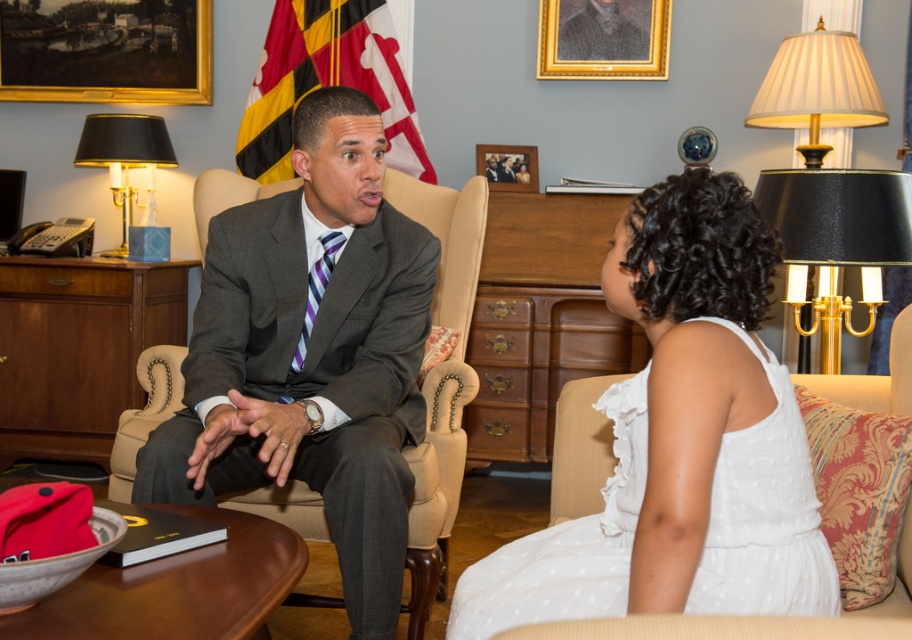
Between black fabric lampshade at left and wooden picture frame at upper center, which one appears on the left side from the viewer's perspective?

black fabric lampshade at left is more to the left.

Between black fabric lampshade at left and wooden picture frame at upper center, which one has less height?

Standing shorter between the two is wooden picture frame at upper center.

Is point (142, 134) less distant than point (478, 170)?

That is True.

Identify the location of black fabric lampshade at left. (123, 156).

Can you confirm if gold-framed portrait at upper center is taller than black fabric lampshade at left?

No.

Who is more forward, (582,42) or (123,221)?

Point (582,42) is more forward.

Is point (609, 3) behind point (157, 138)?

Yes, it is behind point (157, 138).

Locate an element on the screen. gold-framed portrait at upper center is located at coordinates (602, 42).

In the scene shown: Is white dotted dress at center smaller than gold-framed painting at upper left?

No.

Does white dotted dress at center come in front of gold-framed painting at upper left?

Yes, it is in front of gold-framed painting at upper left.

Based on the photo, who is more distant from viewer, (633,512) or (79,33)?

Point (79,33)

You are a GUI agent. You are given a task and a screenshot of the screen. Output one action in this format:
    pyautogui.click(x=<x>, y=<y>)
    Task: Click on the white dotted dress at center
    
    Given the screenshot: What is the action you would take?
    pyautogui.click(x=680, y=442)